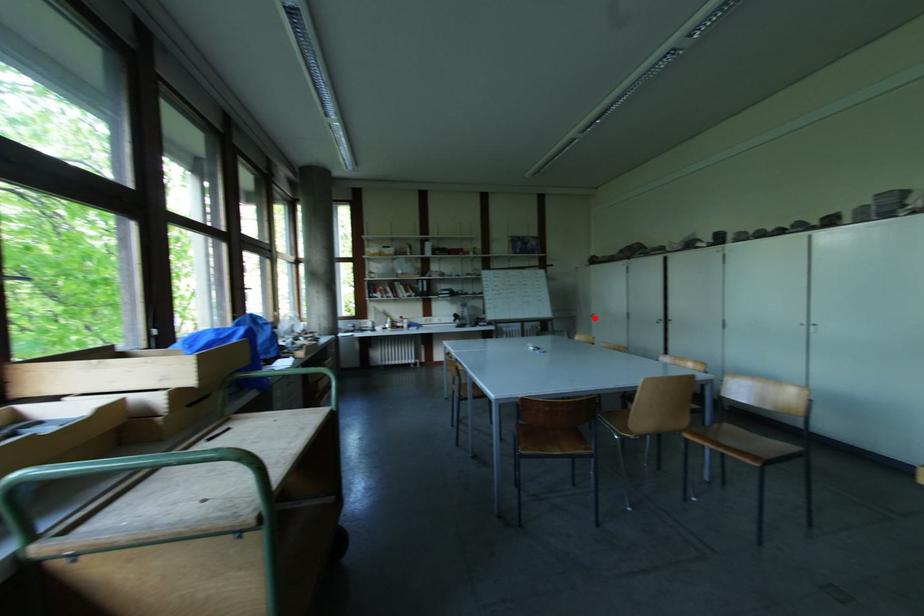
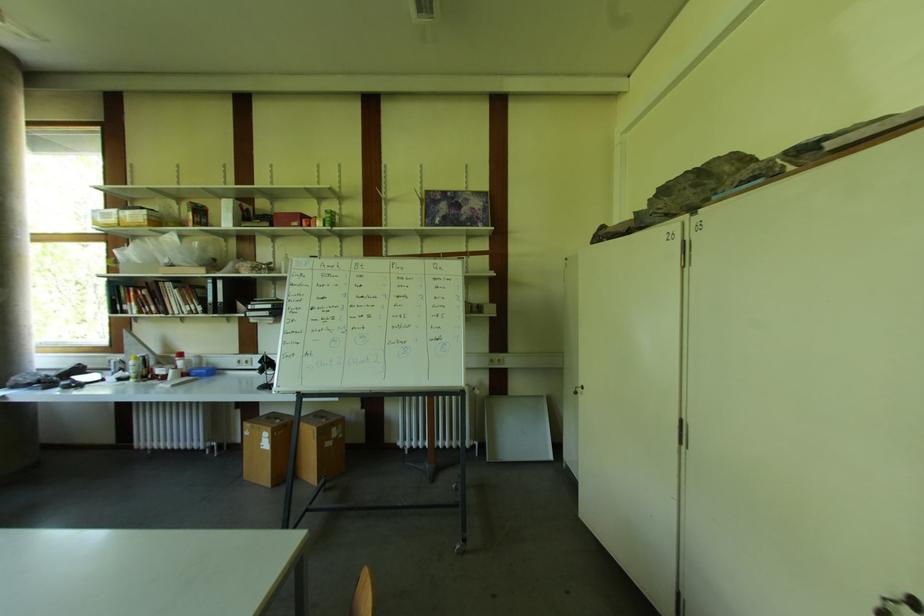
In the second image, find the point that corresponds to the highlighted location in the first image.

(578, 395)